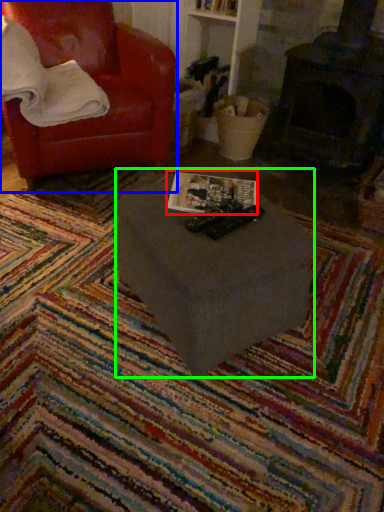
Question: Based on their relative distances, which object is farther from magazine (highlighted by a red box)? Choose from chair (highlighted by a blue box) and table (highlighted by a green box).

Choices:
 (A) chair
 (B) table

Answer: (A)